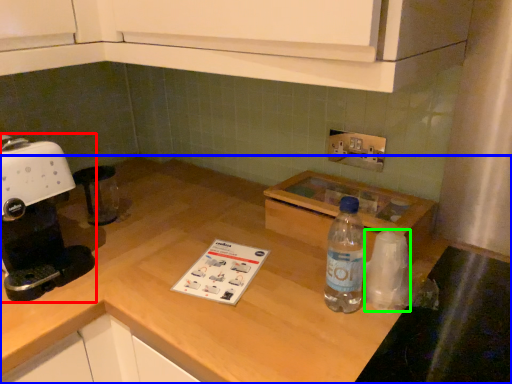
Question: Based on their relative distances, which object is farther from home appliance (highlighted by a red box)? Choose from countertop (highlighted by a blue box) and paper towel (highlighted by a green box).

Choices:
 (A) countertop
 (B) paper towel

Answer: (B)